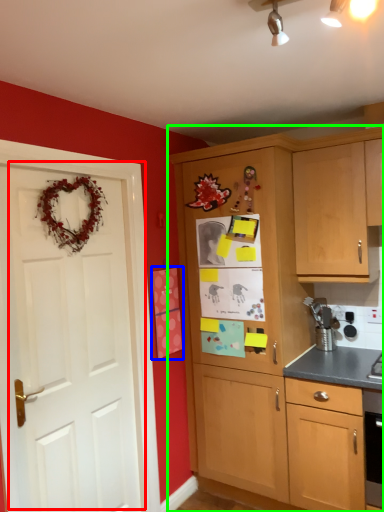
Question: Which is farther away from door (highlighted by a red box)? postcard (highlighted by a blue box) or cabinetry (highlighted by a green box)?

Choices:
 (A) postcard
 (B) cabinetry

Answer: (B)